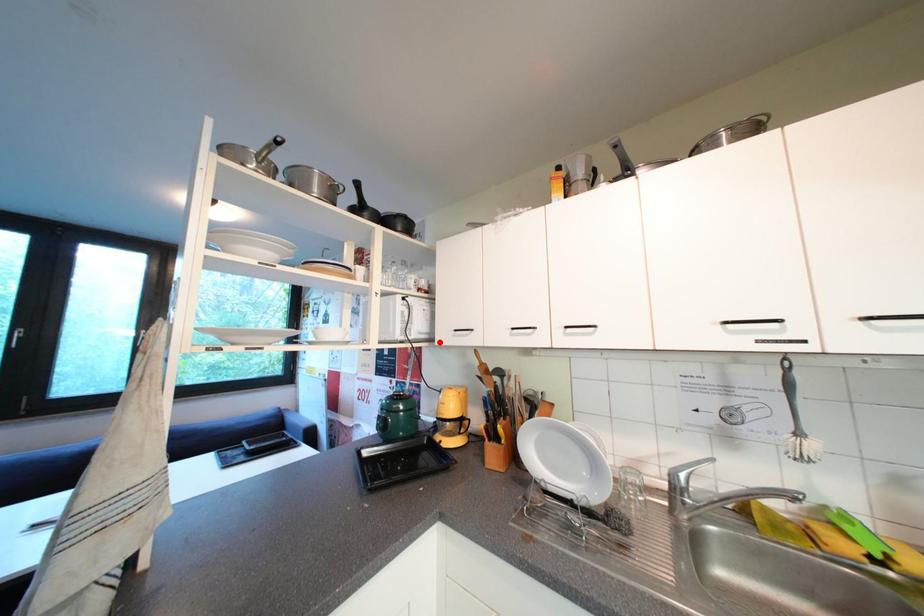
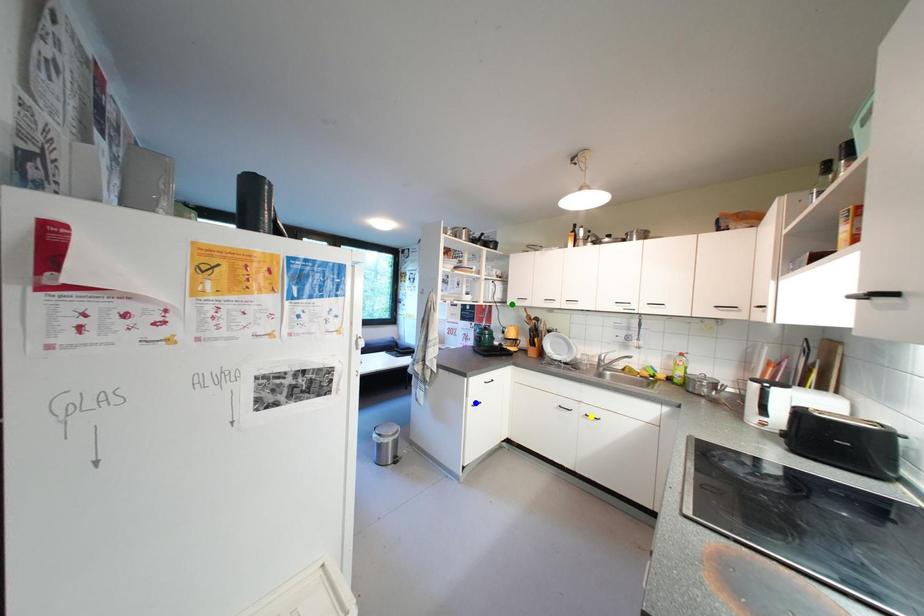
Question: I am providing you with two images of the same scene from different viewpoints. A red point is marked on the first image. You are given multiple points on the second image. Which spot in image 2 lines up with the point in image 1?

Choices:
 (A) yellow point
 (B) green point
 (C) blue point

Answer: (B)